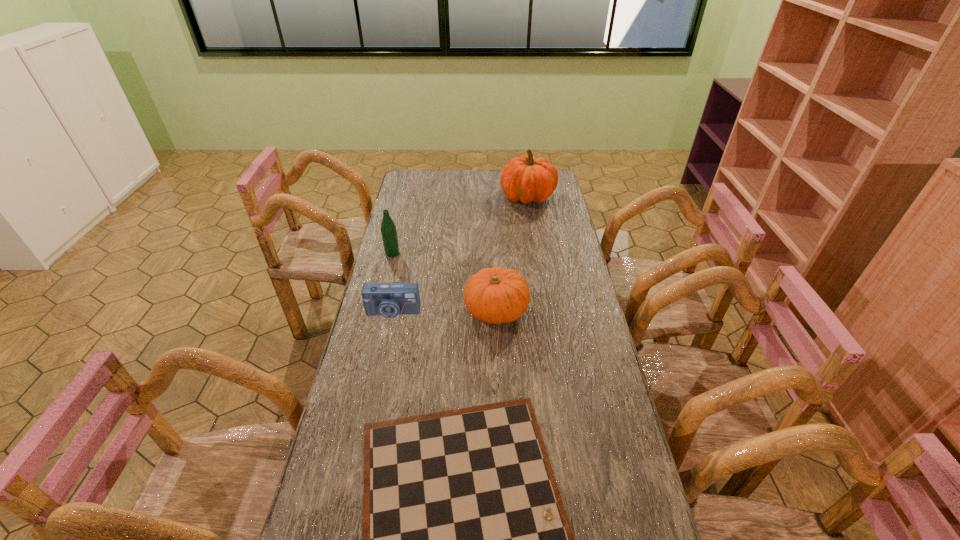
Locate an element on the screen. This screenshot has width=960, height=540. blank space that satisfies the following two spatial constraints: 1. on the back side of the farther pumpkin; 2. on the right side of the nearer pumpkin is located at coordinates tap(492, 197).